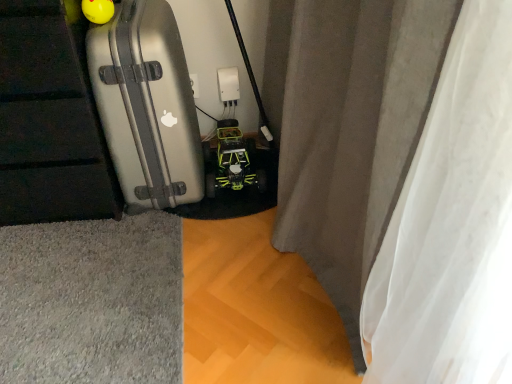
Question: Does gray fabric curtain at center contain yellow-green plastic toy car at center?

Choices:
 (A) no
 (B) yes

Answer: (A)

Question: Can you confirm if gray fabric curtain at center is taller than yellow-green plastic toy car at center?

Choices:
 (A) no
 (B) yes

Answer: (B)

Question: Is gray fabric curtain at center oriented towards yellow-green plastic toy car at center?

Choices:
 (A) no
 (B) yes

Answer: (B)

Question: Is gray fabric curtain at center next to yellow-green plastic toy car at center and touching it?

Choices:
 (A) yes
 (B) no

Answer: (B)

Question: Is the position of gray fabric curtain at center more distant than that of yellow-green plastic toy car at center?

Choices:
 (A) no
 (B) yes

Answer: (A)

Question: Considering the relative sizes of gray fabric curtain at center and yellow-green plastic toy car at center in the image provided, is gray fabric curtain at center wider than yellow-green plastic toy car at center?

Choices:
 (A) no
 (B) yes

Answer: (A)

Question: Is yellow-green plastic toy car at center taller than gray fabric curtain at center?

Choices:
 (A) yes
 (B) no

Answer: (B)

Question: Does yellow-green plastic toy car at center appear on the right side of gray fabric curtain at center?

Choices:
 (A) no
 (B) yes

Answer: (A)

Question: Is yellow-green plastic toy car at center not close to gray fabric curtain at center?

Choices:
 (A) yes
 (B) no

Answer: (B)

Question: Is yellow-green plastic toy car at center turned away from gray fabric curtain at center?

Choices:
 (A) no
 (B) yes

Answer: (A)

Question: Considering the relative sizes of yellow-green plastic toy car at center and gray fabric curtain at center in the image provided, is yellow-green plastic toy car at center smaller than gray fabric curtain at center?

Choices:
 (A) yes
 (B) no

Answer: (A)

Question: Is yellow-green plastic toy car at center to the left of gray fabric curtain at center from the viewer's perspective?

Choices:
 (A) no
 (B) yes

Answer: (B)

Question: Is gray fabric curtain at center surrounding silver metallic suitcase at left?

Choices:
 (A) no
 (B) yes

Answer: (A)